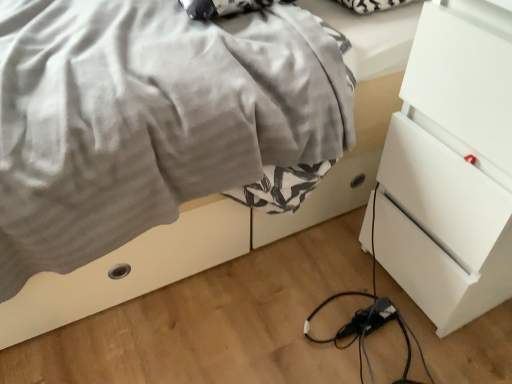
Question: Considering the relative sizes of black plastic extension cord at lower center and satin gray blanket at center in the image provided, is black plastic extension cord at lower center smaller than satin gray blanket at center?

Choices:
 (A) yes
 (B) no

Answer: (A)

Question: Is black plastic extension cord at lower center closer to camera compared to satin gray blanket at center?

Choices:
 (A) no
 (B) yes

Answer: (A)

Question: Does black plastic extension cord at lower center have a greater height compared to satin gray blanket at center?

Choices:
 (A) no
 (B) yes

Answer: (A)

Question: Is black plastic extension cord at lower center wider than satin gray blanket at center?

Choices:
 (A) yes
 (B) no

Answer: (B)

Question: Does black plastic extension cord at lower center have a larger size compared to satin gray blanket at center?

Choices:
 (A) yes
 (B) no

Answer: (B)

Question: Is black plastic extension cord at lower center positioned beyond the bounds of satin gray blanket at center?

Choices:
 (A) yes
 (B) no

Answer: (A)

Question: Is white glossy chest of drawers at right outside of satin gray blanket at center?

Choices:
 (A) yes
 (B) no

Answer: (A)

Question: Does white glossy chest of drawers at right have a larger size compared to satin gray blanket at center?

Choices:
 (A) yes
 (B) no

Answer: (B)

Question: Could you tell me if white glossy chest of drawers at right is facing satin gray blanket at center?

Choices:
 (A) no
 (B) yes

Answer: (A)

Question: Can you confirm if white glossy chest of drawers at right is positioned to the right of satin gray blanket at center?

Choices:
 (A) no
 (B) yes

Answer: (B)

Question: Is white glossy chest of drawers at right far from satin gray blanket at center?

Choices:
 (A) no
 (B) yes

Answer: (A)

Question: Is white glossy chest of drawers at right positioned before satin gray blanket at center?

Choices:
 (A) yes
 (B) no

Answer: (A)

Question: Is satin gray blanket at center not within white glossy chest of drawers at right?

Choices:
 (A) yes
 (B) no

Answer: (A)